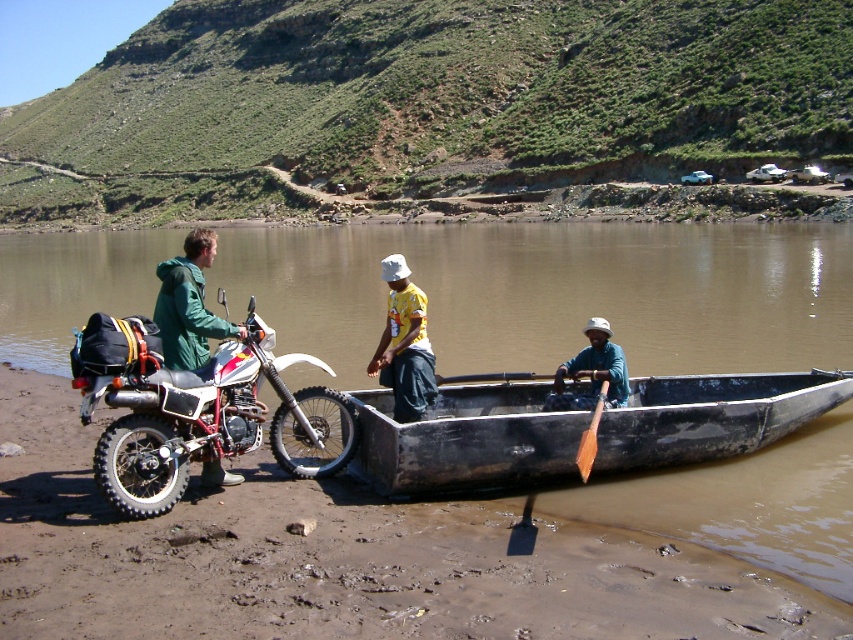
Find the location of a particular element. This screenshot has height=640, width=853. green matte jacket at left is located at coordinates (189, 305).

How far apart are green matte jacket at left and teal fabric hat at center?

They are 17.41 meters apart.

Is point (158, 300) farther from viewer compared to point (550, 400)?

No, it is in front of (550, 400).

Find the location of a particular element. green matte jacket at left is located at coordinates coord(189,305).

Which is more to the left, black wooden canoe at lower center or matte black motorcycle at left?

Positioned to the left is matte black motorcycle at left.

Which is behind, point (692, 387) or point (216, 403)?

The point (692, 387) is behind.

The width and height of the screenshot is (853, 640). I want to click on black wooden canoe at lower center, so click(467, 438).

Is green matte jacket at left below yellow fabric shirt at center?

Actually, green matte jacket at left is above yellow fabric shirt at center.

Measure the distance between point (204, 268) and camera.

Point (204, 268) and camera are 47.27 meters apart.

Identify the location of green matte jacket at left. The width and height of the screenshot is (853, 640). point(189,305).